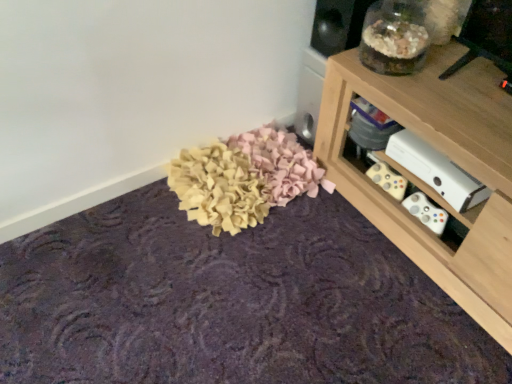
The height and width of the screenshot is (384, 512). In order to click on blank space situated above wooden shelf at upper right (from a real-world perspective) in this screenshot , I will do `click(456, 81)`.